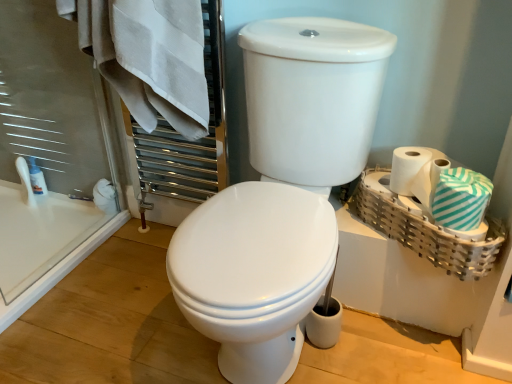
You are a GUI agent. You are given a task and a screenshot of the screen. Output one action in this format:
    pyautogui.click(x=<x>, y=<y>)
    Task: Click on the vacant space in between teal striped fabric at right, positioned as the second bath towel in left-to-right order, and white matte toilet paper at right
    
    Given the screenshot: What is the action you would take?
    pyautogui.click(x=410, y=198)